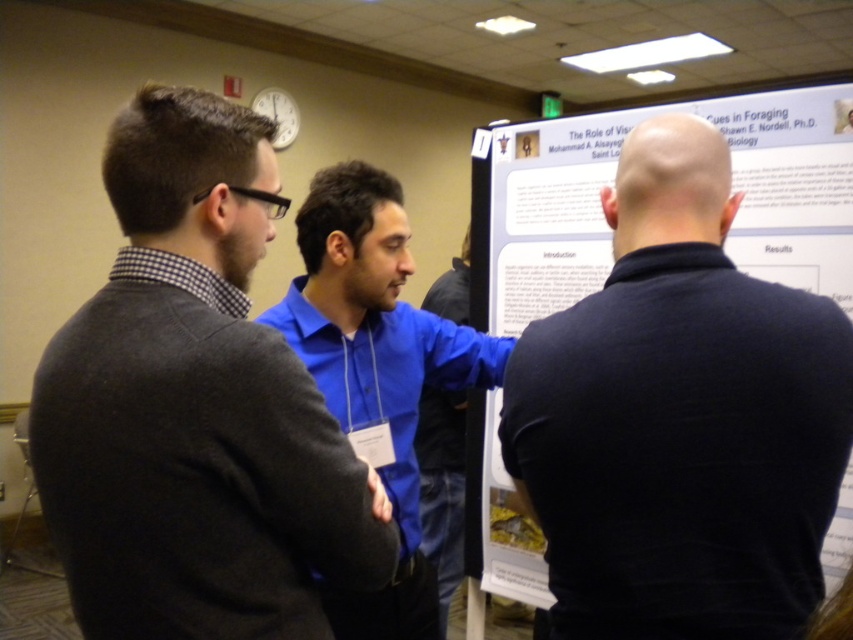
You are a photographer trying to capture a clear photo of the poster board. There are two people in the way. Which person should you ask to move so that the blue shirt at center and the blue smooth shirt at center are no longer blocking your view?

You should ask the blue shirt at center to move because it is larger and would block more of the poster board than the blue smooth shirt at center.

What is the spatial relationship between the black matte shirt at center and the other objects in the scene?

The black matte shirt at center is positioned at coordinates point (680, 419), but without additional object descriptions, I cannot specify its relation to others.

From the picture: You are attending a conference and notice two people in the foreground of the poster presentation. The black matte shirt at center and the blue smooth shirt at center are both visible. Which of these two shirts takes up more visual space in the image?

The blue smooth shirt at center takes up more visual space than the black matte shirt at center because the black matte shirt at center occupies less space than blue smooth shirt at center.